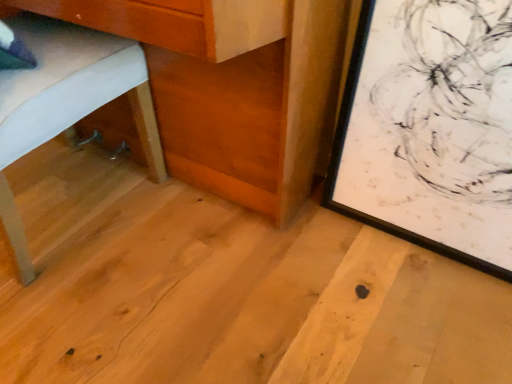
What do you see at coordinates (67, 102) in the screenshot? I see `matte white bed at left` at bounding box center [67, 102].

You are a GUI agent. You are given a task and a screenshot of the screen. Output one action in this format:
    pyautogui.click(x=<x>, y=<y>)
    Task: Click on the matte white bed at left
    Image resolution: width=512 pixels, height=384 pixels.
    Given the screenshot: What is the action you would take?
    pyautogui.click(x=67, y=102)

Are matte white bed at left and natural wood table at lower left located far from each other?

matte white bed at left is near natural wood table at lower left, not far away.

Considering the relative positions of matte white bed at left and natural wood table at lower left in the image provided, is matte white bed at left to the right of natural wood table at lower left from the viewer's perspective?

Incorrect, matte white bed at left is not on the right side of natural wood table at lower left.

Is the depth of matte white bed at left greater than that of natural wood table at lower left?

No.

From a real-world perspective, does matte white bed at left sit lower than natural wood table at lower left?

Correct, in the physical world, matte white bed at left is lower than natural wood table at lower left.

Locate an element on the screen. picture frame below the natural wood table at lower left (from the image's perspective) is located at coordinates (430, 128).

Considering the relative positions of black matte picture frame at lower right and natural wood table at lower left in the image provided, is black matte picture frame at lower right to the left or to the right of natural wood table at lower left?

black matte picture frame at lower right is to the right of natural wood table at lower left.

From the image's perspective, which is above, black matte picture frame at lower right or natural wood table at lower left?

natural wood table at lower left, from the image's perspective.

Is point (424, 48) in front of point (306, 98)?

Yes, point (424, 48) is closer to viewer.

From a real-world perspective, which is physically above, natural wood table at lower left or black matte picture frame at lower right?

natural wood table at lower left is physically above.

Does natural wood table at lower left touch black matte picture frame at lower right?

They are not placed beside each other.

From the image's perspective, would you say natural wood table at lower left is shown under black matte picture frame at lower right?

Actually, natural wood table at lower left appears above black matte picture frame at lower right in the image.

Looking at their sizes, would you say natural wood table at lower left is wider or thinner than black matte picture frame at lower right?

natural wood table at lower left is wider than black matte picture frame at lower right.

Is natural wood table at lower left wider or thinner than matte white bed at left?

Considering their sizes, natural wood table at lower left looks slimmer than matte white bed at left.

How much distance is there between natural wood table at lower left and matte white bed at left?

natural wood table at lower left is 26.34 centimeters from matte white bed at left.

From the image's perspective, relative to matte white bed at left, is natural wood table at lower left above or below?

From the image's perspective, natural wood table at lower left appears above matte white bed at left.

From a real-world perspective, relative to matte white bed at left, is natural wood table at lower left vertically above or below?

Clearly, from a real-world perspective, natural wood table at lower left is above matte white bed at left.

What's the angular difference between black matte picture frame at lower right and matte white bed at left's facing directions?

179 degrees.

From the image's perspective, is black matte picture frame at lower right located above or below matte white bed at left?

black matte picture frame at lower right is situated lower than matte white bed at left in the image.

Between black matte picture frame at lower right and matte white bed at left, which one has smaller size?

Smaller between the two is black matte picture frame at lower right.

Is black matte picture frame at lower right positioned with its back to matte white bed at left?

No.

How different are the orientations of matte white bed at left and black matte picture frame at lower right in degrees?

There is a 179-degree angle between the facing directions of matte white bed at left and black matte picture frame at lower right.

Does matte white bed at left have a greater width compared to black matte picture frame at lower right?

Yes, matte white bed at left is wider than black matte picture frame at lower right.

From the image's perspective, between matte white bed at left and black matte picture frame at lower right, which one is located above?

From the image's view, matte white bed at left is above.

At what (x,y) coordinates should I click in order to perform the action: click on furniture lying on the left of natural wood table at lower left. Please return your answer as a coordinate pair (x, y). The width and height of the screenshot is (512, 384). Looking at the image, I should click on (67, 102).

Where is `table in front of the black matte picture frame at lower right`? table in front of the black matte picture frame at lower right is located at coordinates (234, 87).

Based on the photo, from the image, which object appears to be nearer to matte white bed at left, natural wood table at lower left or black matte picture frame at lower right?

Based on the image, natural wood table at lower left appears to be nearer to matte white bed at left.

From the image, which object appears to be nearer to black matte picture frame at lower right, natural wood table at lower left or matte white bed at left?

Based on the image, natural wood table at lower left appears to be nearer to black matte picture frame at lower right.

Based on their spatial positions, is black matte picture frame at lower right or matte white bed at left further from natural wood table at lower left?

black matte picture frame at lower right.

Based on their spatial positions, is matte white bed at left or natural wood table at lower left closer to black matte picture frame at lower right?

natural wood table at lower left lies closer to black matte picture frame at lower right than the other object.

Looking at the image, which one is located closer to matte white bed at left, black matte picture frame at lower right or natural wood table at lower left?

natural wood table at lower left.

Which object lies further to the anchor point natural wood table at lower left, matte white bed at left or black matte picture frame at lower right?

black matte picture frame at lower right lies further to natural wood table at lower left than the other object.

Where is `table situated between matte white bed at left and black matte picture frame at lower right from left to right`? The image size is (512, 384). table situated between matte white bed at left and black matte picture frame at lower right from left to right is located at coordinates (234, 87).